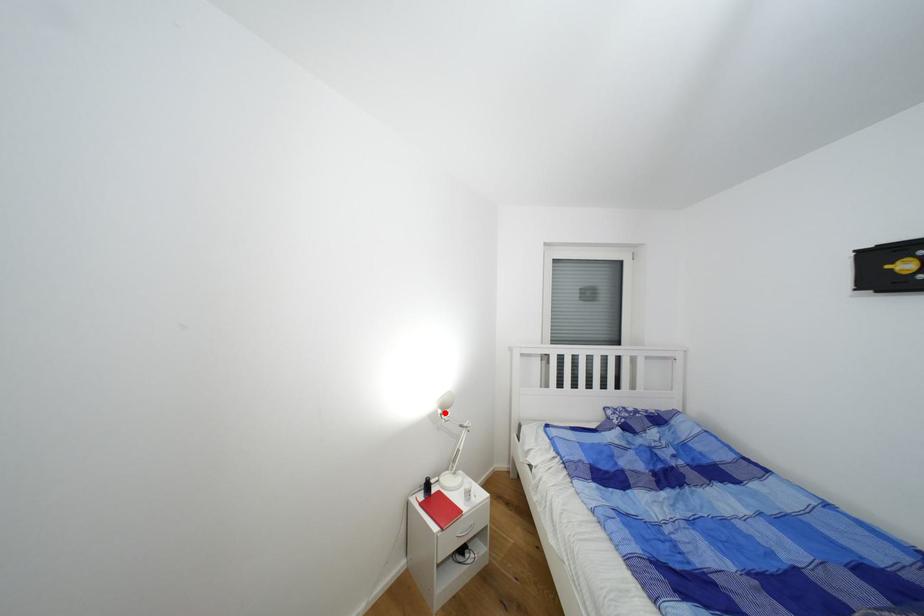
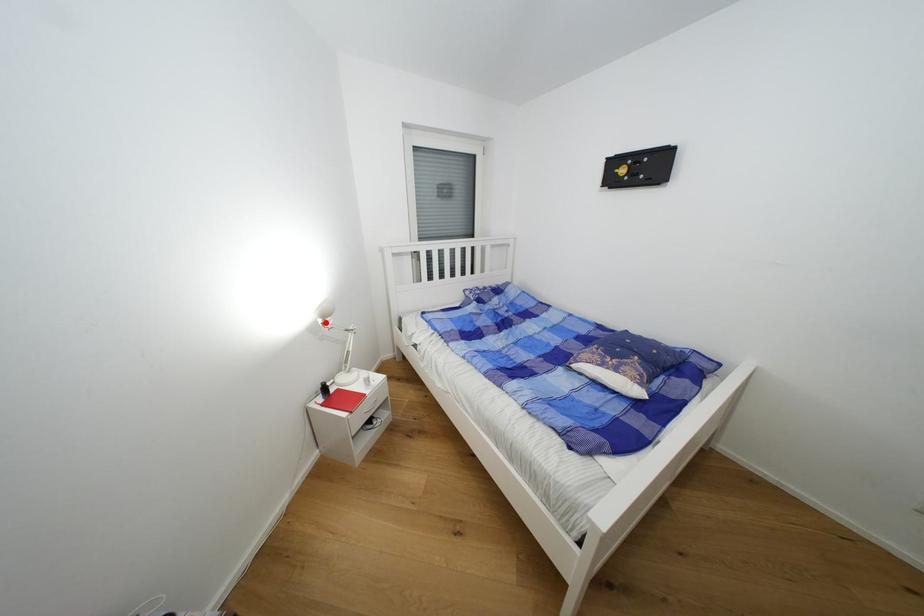
I am providing you with two images of the same scene from different viewpoints. A red point is marked on the first image and another point is marked on the second image. Is the red point in image1 aligned with the point shown in image2?

Yes